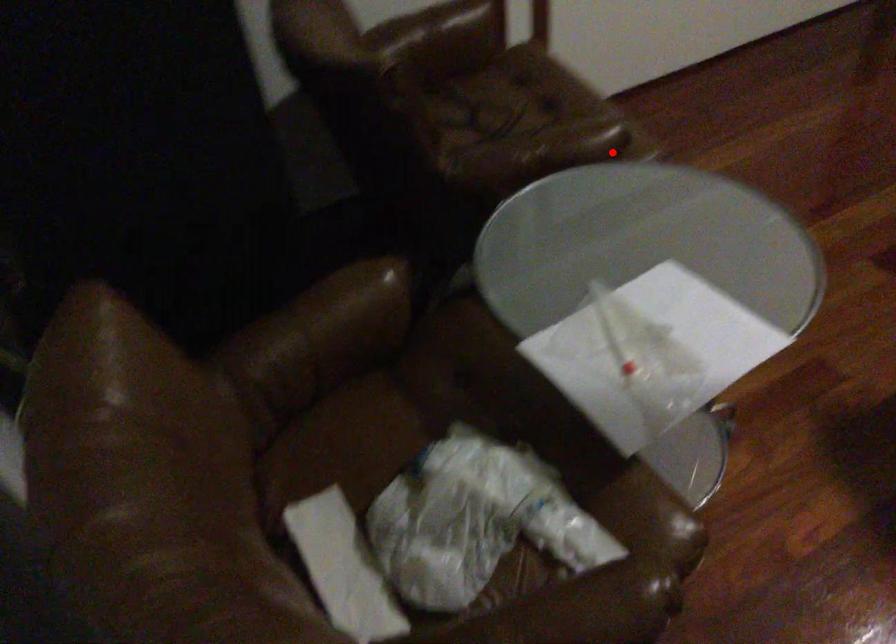
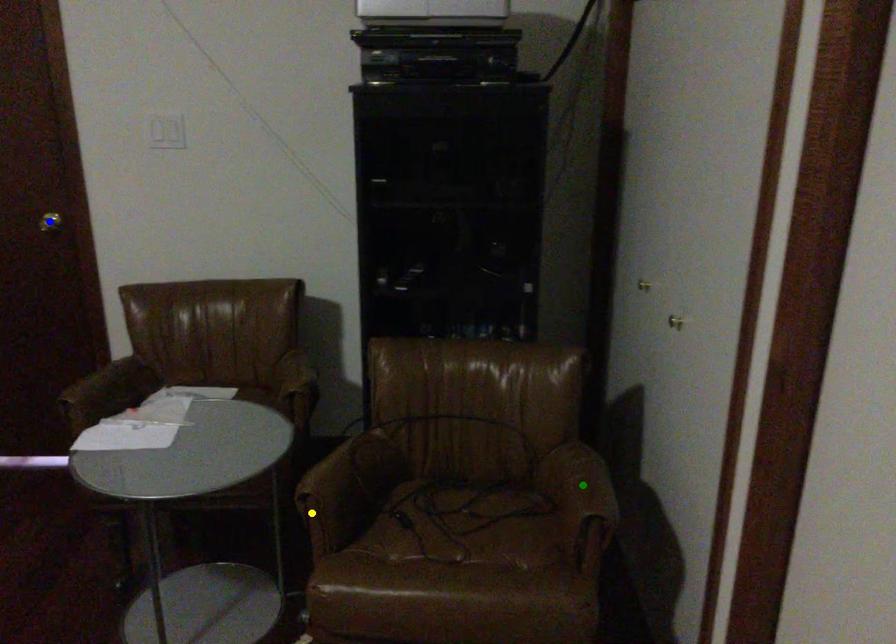
Question: I am providing you with two images of the same scene from different viewpoints. A red point is marked on the first image. You are given multiple points on the second image. In image 2, which mark is for the same physical point as the one in image 1?

Choices:
 (A) green point
 (B) blue point
 (C) yellow point

Answer: (C)